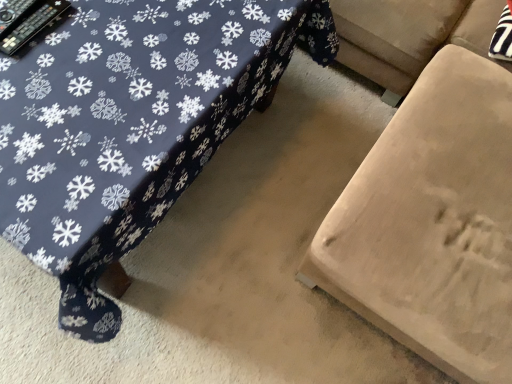
The image size is (512, 384). I want to click on free point above dark blue fabric table at center (from a real-world perspective), so click(x=116, y=80).